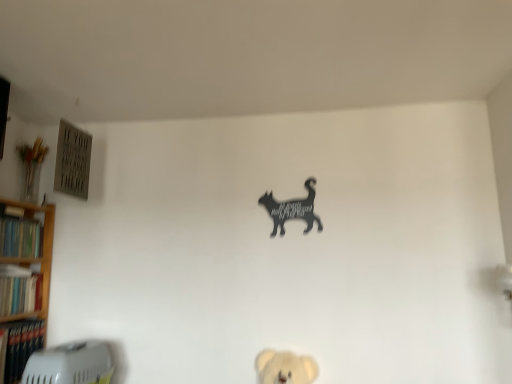
Describe the element at coordinates (292, 209) in the screenshot. The height and width of the screenshot is (384, 512). I see `black matte cat at upper center` at that location.

Measure the distance between hardcover book at left, the third book from the bottom, and camera.

The depth of hardcover book at left, the third book from the bottom, is 2.42 meters.

What do you see at coordinates (19, 290) in the screenshot? This screenshot has width=512, height=384. I see `hardcover book at left, the second book positioned from the bottom` at bounding box center [19, 290].

The image size is (512, 384). Identify the location of hardcover book at left, which is counted as the third book, starting from the top. (22, 346).

Can you confirm if black matte cat at upper center is positioned to the right of hardcover book at left, the third book from the bottom?

Yes.

Is point (319, 228) more distant than point (34, 228)?

No.

Is black matte cat at upper center positioned before hardcover book at left, the third book from the bottom?

No, black matte cat at upper center is further to the viewer.

From the image's perspective, is hardcover book at left, which ranks as the second book in top-to-bottom order, under black matte cat at upper center?

Indeed, from the image's perspective, hardcover book at left, which ranks as the second book in top-to-bottom order, is shown beneath black matte cat at upper center.

Would you say black matte cat at upper center is part of hardcover book at left, which ranks as the second book in top-to-bottom order,'s contents?

Definitely not — black matte cat at upper center is not inside hardcover book at left, which ranks as the second book in top-to-bottom order.

From a real-world perspective, who is located lower, hardcover book at left, the second book positioned from the bottom, or black matte cat at upper center?

In real-world perspective, hardcover book at left, the second book positioned from the bottom, is lower.

Is point (3, 302) closer to camera compared to point (267, 198)?

Yes, it is in front of point (267, 198).

Could you tell me if hardcover book at left, which ranks as the second book in top-to-bottom order, is facing hardcover book at left, which is counted as the third book, starting from the top?

No, hardcover book at left, which ranks as the second book in top-to-bottom order, does not turn towards hardcover book at left, which is counted as the third book, starting from the top.

Based on the photo, from the image's perspective, is hardcover book at left, which ranks as the second book in top-to-bottom order, located beneath hardcover book at left, which is counted as the third book, starting from the top?

Actually, hardcover book at left, which ranks as the second book in top-to-bottom order, appears above hardcover book at left, which is counted as the third book, starting from the top, in the image.

From a real-world perspective, which object rests below the other?

In real-world perspective, hardcover book at left, which is the 1th book from bottom to top, is lower.

How much distance is there between hardcover book at left, which ranks as the second book in top-to-bottom order, and hardcover book at left, which is counted as the third book, starting from the top?

hardcover book at left, which ranks as the second book in top-to-bottom order, is 7.09 inches from hardcover book at left, which is counted as the third book, starting from the top.

Does hardcover book at left, which ranks as the second book in top-to-bottom order, have a greater height compared to hardcover book at left, the first book from the top?

Indeed, hardcover book at left, which ranks as the second book in top-to-bottom order, has a greater height compared to hardcover book at left, the first book from the top.

Is hardcover book at left, which ranks as the second book in top-to-bottom order, oriented away from hardcover book at left, the first book from the top?

No, hardcover book at left, the first book from the top, is not at the back of hardcover book at left, which ranks as the second book in top-to-bottom order.

Relative to hardcover book at left, the first book from the top, is hardcover book at left, the second book positioned from the bottom, in front or behind?

Clearly, hardcover book at left, the second book positioned from the bottom, is in front of hardcover book at left, the first book from the top.

From the image's perspective, between hardcover book at left, the second book positioned from the bottom, and hardcover book at left, the third book from the bottom, who is located below?

From the image's view, hardcover book at left, the second book positioned from the bottom, is below.

Is black matte cat at upper center directly adjacent to hardcover book at left, which ranks as the second book in top-to-bottom order?

black matte cat at upper center and hardcover book at left, which ranks as the second book in top-to-bottom order, are clearly separated.

Can hardcover book at left, the second book positioned from the bottom, be found inside black matte cat at upper center?

That's incorrect, hardcover book at left, the second book positioned from the bottom, is not inside black matte cat at upper center.

From the image's perspective, is black matte cat at upper center beneath hardcover book at left, which ranks as the second book in top-to-bottom order?

Incorrect, from the image's perspective, black matte cat at upper center is higher than hardcover book at left, which ranks as the second book in top-to-bottom order.

How many degrees apart are the facing directions of black matte cat at upper center and hardcover book at left, the second book positioned from the bottom?

92.8 degrees separate the facing orientations of black matte cat at upper center and hardcover book at left, the second book positioned from the bottom.

Is hardcover book at left, which is counted as the third book, starting from the top, positioned with its back to wooden bookshelf at left?

Yes, hardcover book at left, which is counted as the third book, starting from the top, is positioned with its back facing wooden bookshelf at left.

Is wooden bookshelf at left inside hardcover book at left, which is counted as the third book, starting from the top?

No, wooden bookshelf at left is not a part of hardcover book at left, which is counted as the third book, starting from the top.

From a real-world perspective, relative to wooden bookshelf at left, is hardcover book at left, which is counted as the third book, starting from the top, vertically above or below?

In terms of real-world spatial position, hardcover book at left, which is counted as the third book, starting from the top, is below wooden bookshelf at left.

Who is more distant, hardcover book at left, which is the 1th book from bottom to top, or wooden bookshelf at left?

hardcover book at left, which is the 1th book from bottom to top, is behind.

The width and height of the screenshot is (512, 384). I want to click on shelf lying on the right of hardcover book at left, the third book from the bottom, so click(24, 283).

From a real-world perspective, between hardcover book at left, the first book from the top, and wooden bookshelf at left, who is vertically higher?

hardcover book at left, the first book from the top, is physically above.

Is hardcover book at left, the third book from the bottom, wider or thinner than wooden bookshelf at left?

Clearly, hardcover book at left, the third book from the bottom, has less width compared to wooden bookshelf at left.

Is hardcover book at left, the first book from the top, far from wooden bookshelf at left?

That's not correct — hardcover book at left, the first book from the top, is a little close to wooden bookshelf at left.

The image size is (512, 384). I want to click on the 3rd book counting from the left side of the black matte cat at upper center, so pyautogui.click(x=20, y=237).

Find the location of a particular element. animal lying above the hardcover book at left, which ranks as the second book in top-to-bottom order (from the image's perspective) is located at coordinates (292, 209).

Looking at this image, from the image, which object appears to be farther from wooden bookshelf at left, hardcover book at left, the first book from the top, or hardcover book at left, which is counted as the third book, starting from the top?

hardcover book at left, which is counted as the third book, starting from the top.

Which object lies nearer to the anchor point hardcover book at left, the second book positioned from the bottom, hardcover book at left, the first book from the top, or wooden bookshelf at left?

wooden bookshelf at left lies closer to hardcover book at left, the second book positioned from the bottom, than the other object.

When comparing their distances from hardcover book at left, the first book from the top, does hardcover book at left, the second book positioned from the bottom, or wooden bookshelf at left seem closer?

The object closer to hardcover book at left, the first book from the top, is wooden bookshelf at left.

When comparing their distances from wooden bookshelf at left, does black matte cat at upper center or hardcover book at left, the third book from the bottom, seem further?

Among the two, black matte cat at upper center is located further to wooden bookshelf at left.

From the image, which object appears to be nearer to wooden bookshelf at left, hardcover book at left, which ranks as the second book in top-to-bottom order, or hardcover book at left, the first book from the top?

hardcover book at left, which ranks as the second book in top-to-bottom order, is closer to wooden bookshelf at left.

Which object lies nearer to the anchor point hardcover book at left, the third book from the bottom, hardcover book at left, the second book positioned from the bottom, or hardcover book at left, which is counted as the third book, starting from the top?

hardcover book at left, the second book positioned from the bottom, is closer to hardcover book at left, the third book from the bottom.

Estimate the real-world distances between objects in this image. Which object is closer to hardcover book at left, the second book positioned from the bottom, hardcover book at left, which is counted as the third book, starting from the top, or black matte cat at upper center?

hardcover book at left, which is counted as the third book, starting from the top, lies closer to hardcover book at left, the second book positioned from the bottom, than the other object.

When comparing their distances from wooden bookshelf at left, does black matte cat at upper center or hardcover book at left, which is counted as the third book, starting from the top, seem further?

The object further to wooden bookshelf at left is black matte cat at upper center.

The image size is (512, 384). I want to click on book located between hardcover book at left, which ranks as the second book in top-to-bottom order, and black matte cat at upper center in the left-right direction, so click(x=22, y=346).

Where is `shelf between hardcover book at left, the first book from the top, and hardcover book at left, which is the 1th book from bottom to top, in the vertical direction`? shelf between hardcover book at left, the first book from the top, and hardcover book at left, which is the 1th book from bottom to top, in the vertical direction is located at coordinates (24, 283).

You are a GUI agent. You are given a task and a screenshot of the screen. Output one action in this format:
    pyautogui.click(x=<x>, y=<y>)
    Task: Click on the shelf located between hardcover book at left, the first book from the top, and black matte cat at upper center in the left-right direction
    This screenshot has width=512, height=384.
    Given the screenshot: What is the action you would take?
    pyautogui.click(x=24, y=283)

At what (x,y) coordinates should I click in order to perform the action: click on book between wooden bookshelf at left and hardcover book at left, which is counted as the third book, starting from the top, from top to bottom. Please return your answer as a coordinate pair (x, y). This screenshot has height=384, width=512. Looking at the image, I should click on (19, 290).